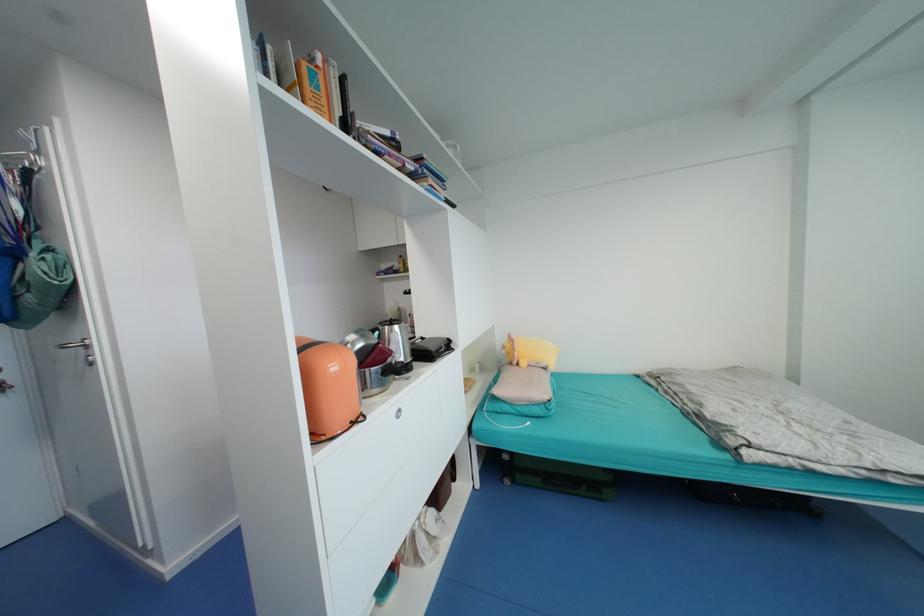
This screenshot has width=924, height=616. What are the coordinates of `orange toaster` in the screenshot? It's located at click(x=329, y=387).